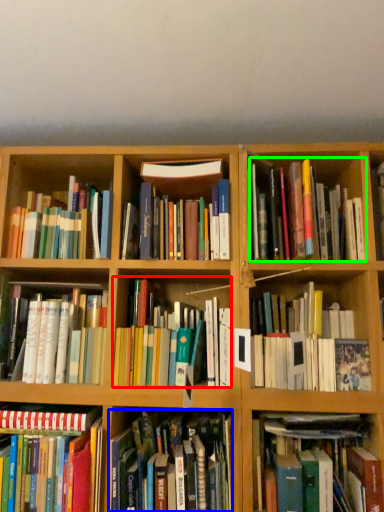
Question: Considering the real-world distances, which object is farthest from book (highlighted by a red box)? book (highlighted by a blue box) or book (highlighted by a green box)?

Choices:
 (A) book
 (B) book

Answer: (B)